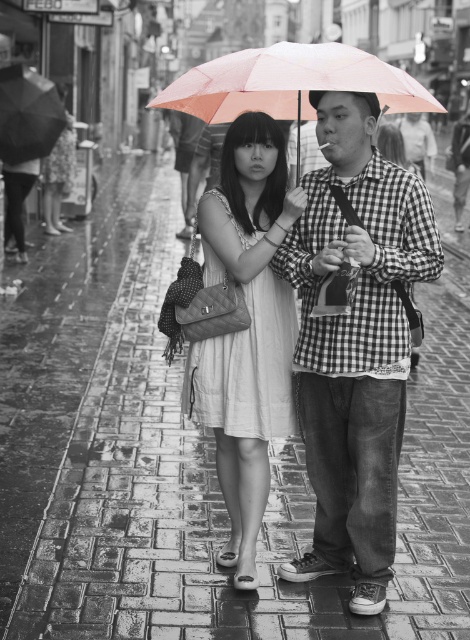
Which is behind, point (352, 486) or point (375, 68)?

Positioned behind is point (352, 486).

This screenshot has height=640, width=470. Identify the location of checkered fabric shirt at center. (354, 342).

Is pink translucent umbrella at center above black matte umbrella at upper center?

No, pink translucent umbrella at center is not above black matte umbrella at upper center.

Between pink translucent umbrella at center and black matte umbrella at upper center, which one is positioned lower?

pink translucent umbrella at center is below.

This screenshot has height=640, width=470. Describe the element at coordinates (290, 83) in the screenshot. I see `pink translucent umbrella at center` at that location.

The height and width of the screenshot is (640, 470). What are the coordinates of `pink translucent umbrella at center` in the screenshot? It's located at (290, 83).

Does point (295, 323) come farther from viewer compared to point (179, 93)?

Yes, it is behind point (179, 93).

Measure the distance from white quilted purse at center to pink translucent umbrella at center.

The distance of white quilted purse at center from pink translucent umbrella at center is 1.83 meters.

Based on the photo, who is more distant from viewer, (235, 168) or (237, 61)?

The point (235, 168) is more distant.

The image size is (470, 640). What are the coordinates of `white quilted purse at center` in the screenshot? It's located at (247, 328).